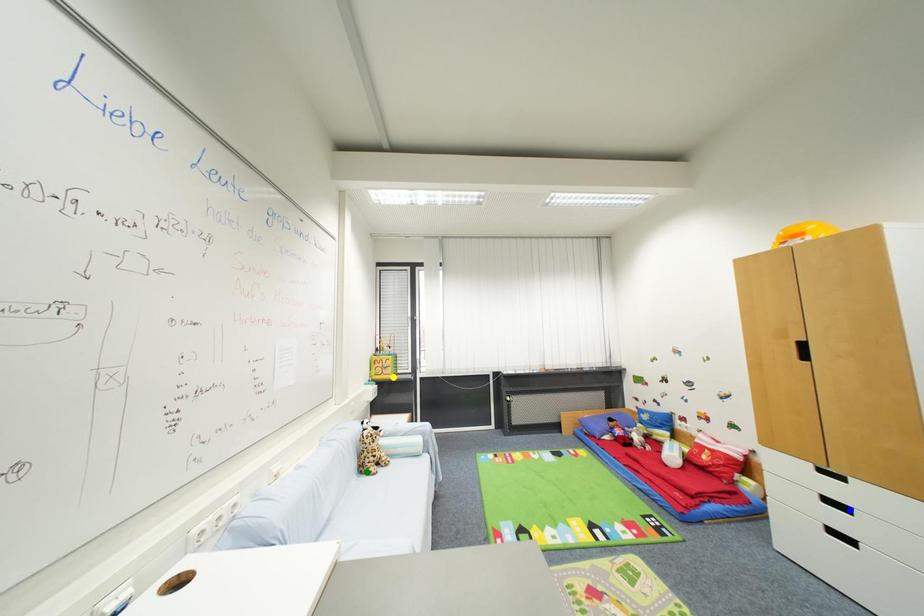
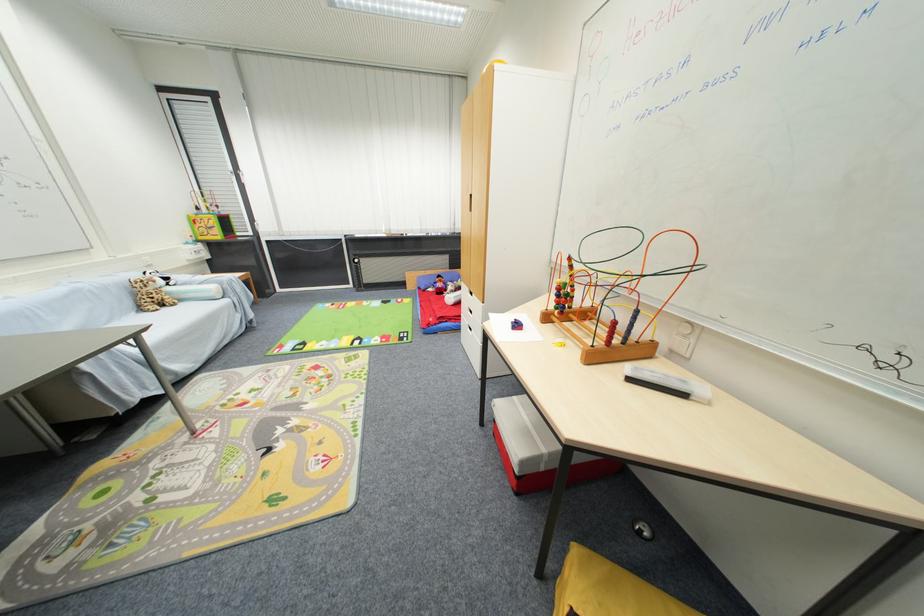
I am providing you with two images of the same scene from different viewpoints. Three points are marked in image1. Which point corresponds to a part or object that is occluded in image2?In image1, three points are marked. Which of them correspond to a part or object that is occluded in image2?Among the three points shown in image1, which one corresponds to a part or object that is no longer visible due to occlusion in image2?

blue point